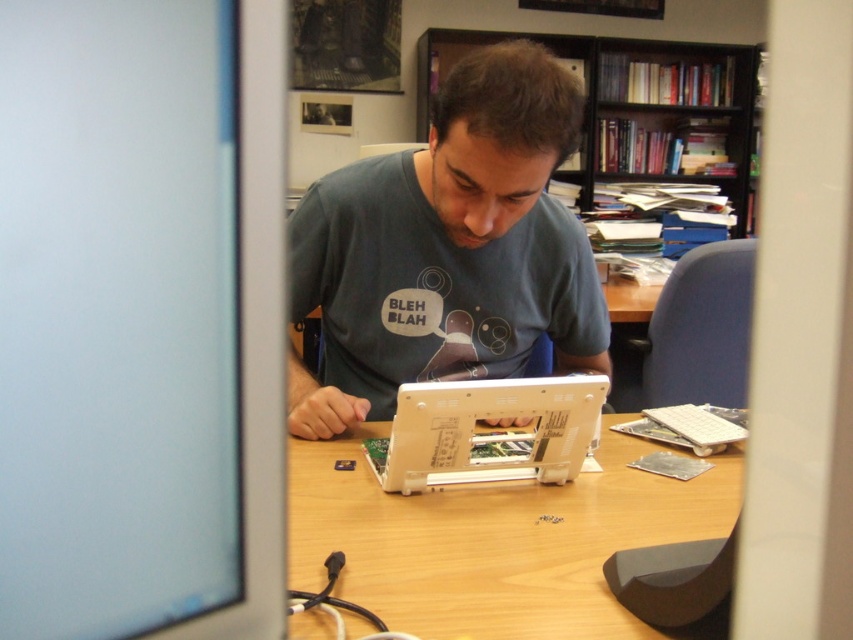
Question: Can you confirm if gray matte shirt at center is positioned below white plastic laptop at center?

Choices:
 (A) no
 (B) yes

Answer: (A)

Question: Which object is positioned farthest from the wooden bookshelf at upper center?

Choices:
 (A) white plastic laptop at center
 (B) gray matte shirt at center
 (C) wooden table at center

Answer: (C)

Question: Does gray matte shirt at center appear under wooden table at center?

Choices:
 (A) yes
 (B) no

Answer: (B)

Question: Which object appears closest to the camera in this image?

Choices:
 (A) white plastic laptop at center
 (B) wooden table at center
 (C) gray matte shirt at center
 (D) matte black monitor at left

Answer: (D)

Question: Which point is closer to the camera?

Choices:
 (A) wooden table at center
 (B) white plastic laptop at center
 (C) gray matte shirt at center
 (D) wooden bookshelf at upper center

Answer: (A)

Question: Is gray matte shirt at center wider than white plastic laptop at center?

Choices:
 (A) yes
 (B) no

Answer: (A)